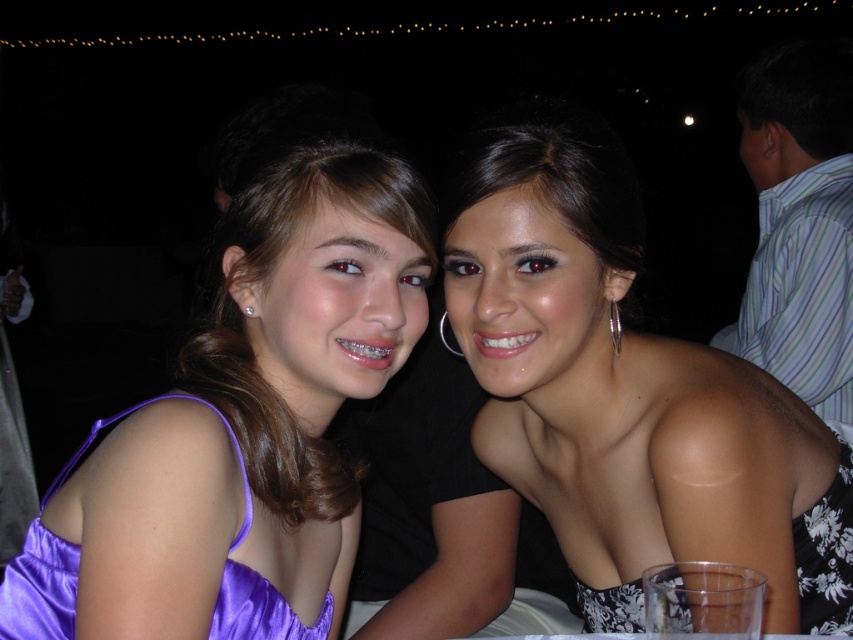
Based on the photo, measure the distance between black satin dress at center and camera.

The distance of black satin dress at center from camera is 32.82 inches.

Can you confirm if black satin dress at center is shorter than purple satin dress at left?

In fact, black satin dress at center may be taller than purple satin dress at left.

Which is in front, point (498, 330) or point (13, 595)?

Positioned in front is point (13, 595).

Image resolution: width=853 pixels, height=640 pixels. What are the coordinates of `black satin dress at center` in the screenshot? It's located at (628, 392).

Consider the image. Between satin purple dress at left and black satin dress at center, which one has less height?

satin purple dress at left is shorter.

Between satin purple dress at left and black satin dress at center, which one appears on the left side from the viewer's perspective?

From the viewer's perspective, satin purple dress at left appears more on the left side.

Which is behind, point (152, 488) or point (555, 291)?

The point (555, 291) is behind.

The height and width of the screenshot is (640, 853). In order to click on satin purple dress at left in this screenshot , I will do `click(242, 426)`.

What do you see at coordinates (242, 426) in the screenshot?
I see `satin purple dress at left` at bounding box center [242, 426].

Locate an element on the screen. The height and width of the screenshot is (640, 853). satin purple dress at left is located at coordinates (242, 426).